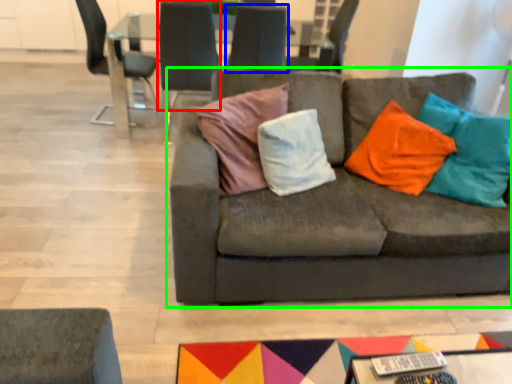
Question: Which object is positioned closest to chair (highlighted by a red box)? Select from chair (highlighted by a blue box) and studio couch (highlighted by a green box).

Choices:
 (A) chair
 (B) studio couch

Answer: (A)